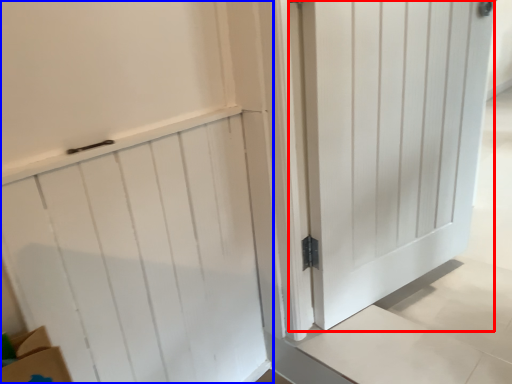
Question: Which of the following is the closest to the observer, door (highlighted by a red box) or door (highlighted by a blue box)?

Choices:
 (A) door
 (B) door

Answer: (B)